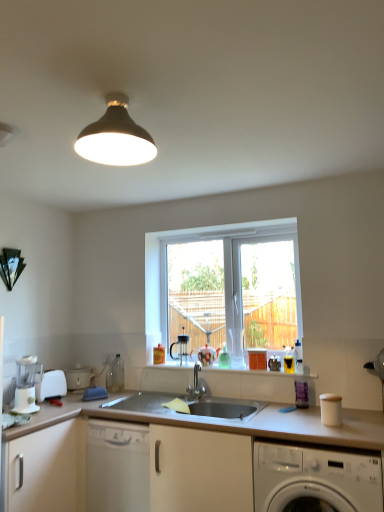
Question: In the image, is white plastic toaster at lower left, which appears as the 2th appliance when viewed from the front, positioned in front of or behind white matte countertop at center?

Choices:
 (A) behind
 (B) front

Answer: (A)

Question: Considering the positions of point (92, 373) and point (362, 497), is point (92, 373) closer or farther from the camera than point (362, 497)?

Choices:
 (A) farther
 (B) closer

Answer: (A)

Question: Considering the real-world distances, which object is closest to the white plastic blender at lower left, arranged as the first coffee machine when viewed from the left?

Choices:
 (A) matte black lampshade at upper center
 (B) white matte cabinet at lower left
 (C) white glossy washing machine at lower right
 (D) black plastic coffee machine at center, the second coffee machine positioned from the front
 (E) white plastic food processor at lower left, acting as the 1th appliance starting from the front

Answer: (E)

Question: Which is farther from the black plastic coffee machine at center, positioned as the first coffee machine in back-to-front order?

Choices:
 (A) white matte countertop at center
 (B) white plastic toaster at lower left, which appears as the 2th appliance when viewed from the front
 (C) matte black lampshade at upper center
 (D) white glass window at center
 (E) translucent glass bottles at center

Answer: (C)